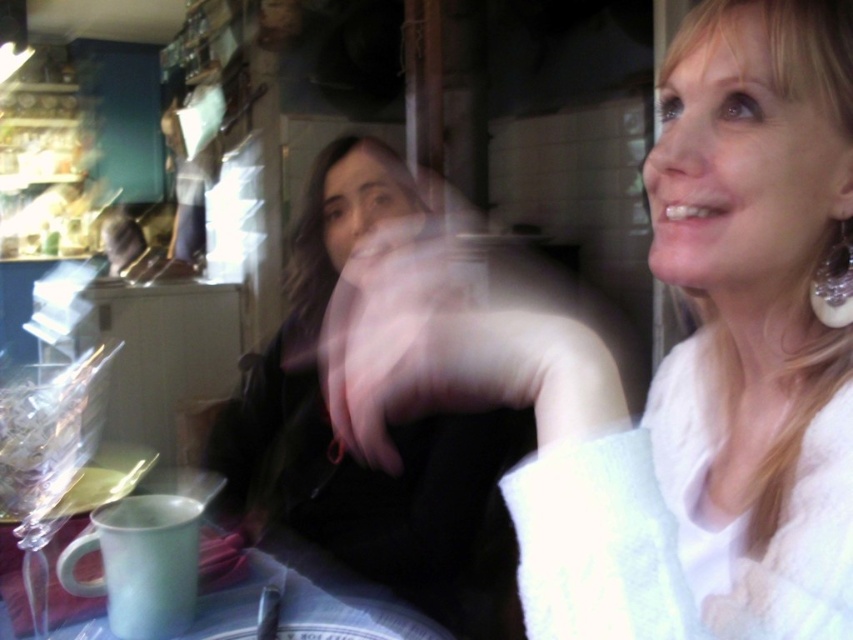
You are a photographer trying to capture a clear shot of both the white fuzzy sweater at upper right and the white fluffy robe at upper right. Since the scene is slightly blurred, you need to adjust your focus. Which object should you focus on first to ensure it appears taller in the final photo?

The white fuzzy sweater at upper right is much taller than the white fluffy robe at upper right, so focusing on the white fuzzy sweater at upper right first will ensure its height is captured clearly.

You are a photographer trying to capture a clear shot of both the white fuzzy sweater at upper right and the smooth black hand at center. Which object should you adjust your focus on to ensure the smaller one is in focus?

The white fuzzy sweater at upper right is smaller than the smooth black hand at center, so you should adjust your focus on the white fuzzy sweater at upper right to ensure the smaller one is in focus.